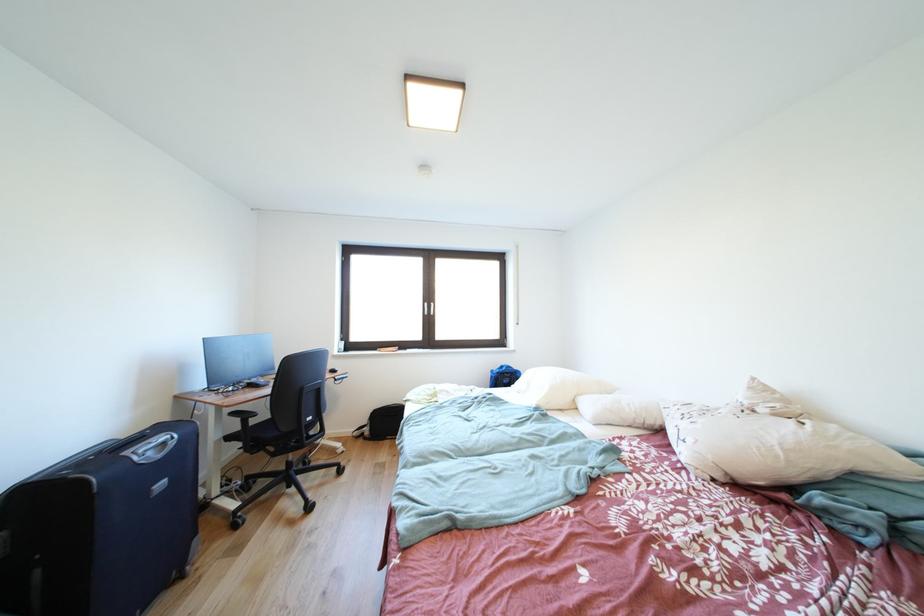
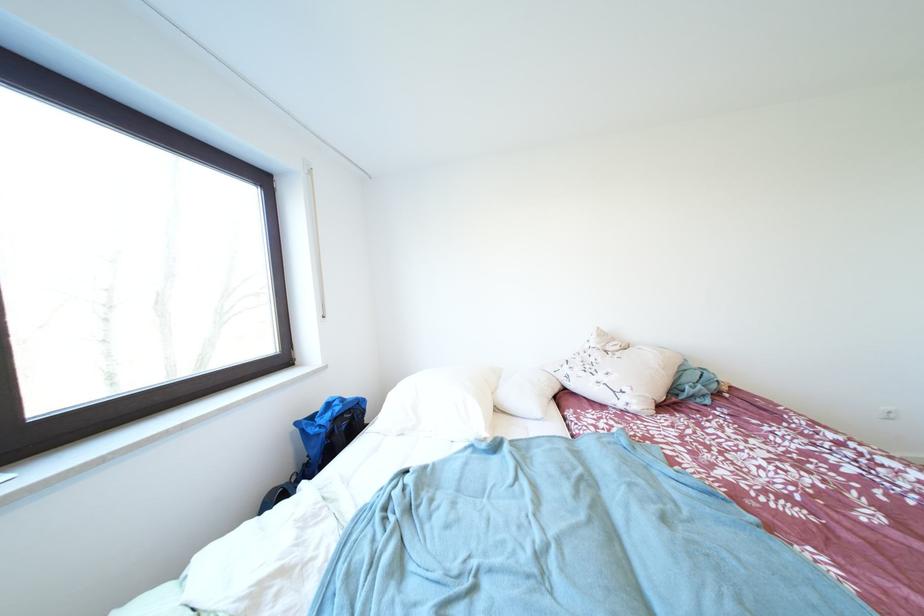
The point at (500, 376) is marked in the first image. Where is the corresponding point in the second image?

(305, 428)